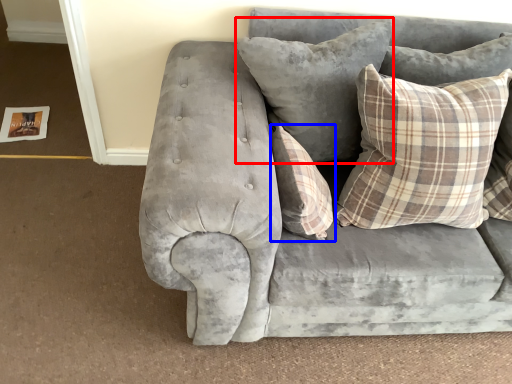
Question: Which object appears closest to the camera in this image, pillow (highlighted by a red box) or pillow (highlighted by a blue box)?

Choices:
 (A) pillow
 (B) pillow

Answer: (B)